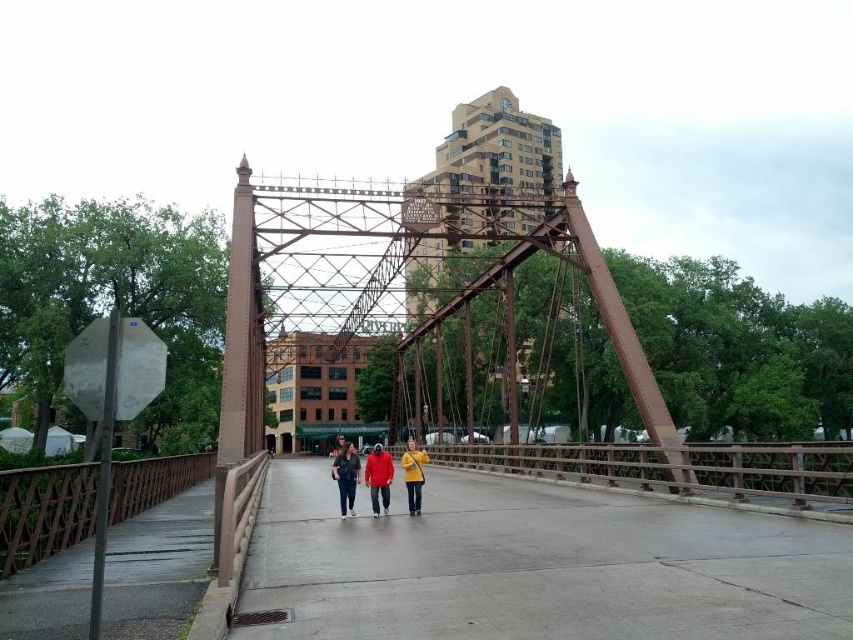
You are standing at the point marked as point (378, 477) on the pedestrian bridge. Looking around, you see the matte red jacket at center. Which direction should you walk to reach the person wearing the matte red jacket at center?

You are already at the location of the matte red jacket at center, which is marked by point (378, 477). There is no need to move further.

You are standing on the pedestrian bridge and want to walk to the end. You notice the gray concrete pavement at center and the matte yellow jacket at center. Which object is wider from your perspective?

The gray concrete pavement at center is wider than the matte yellow jacket at center.

You are a delivery person carrying a large box and need to place it on the gray concrete pavement at center and the red matte jacket at center. Which object can the box be placed on?

The red matte jacket at center has a larger size than the gray concrete pavement at center, so the box can be placed on the red matte jacket at center.